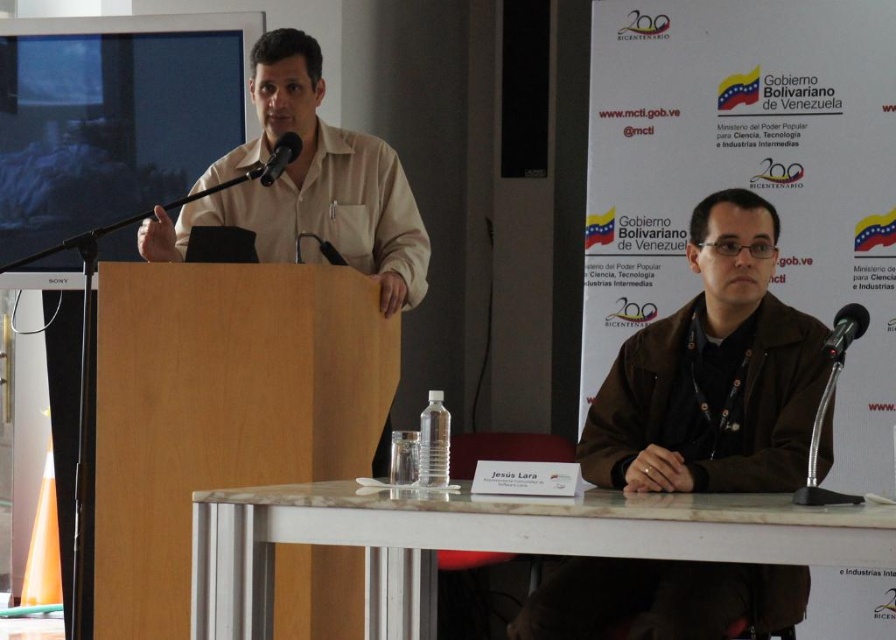
You are attending a conference and want to ask a question to the speaker wearing the beige cotton shirt at center. The microphone is the metallic black microphone at upper center. Can you hear the speaker clearly from where you are standing?

The beige cotton shirt at center is closer to the viewer than the metallic black microphone at upper center, so the speaker is positioned between you and the microphone. This might make it harder to hear the speaker clearly from your current position.